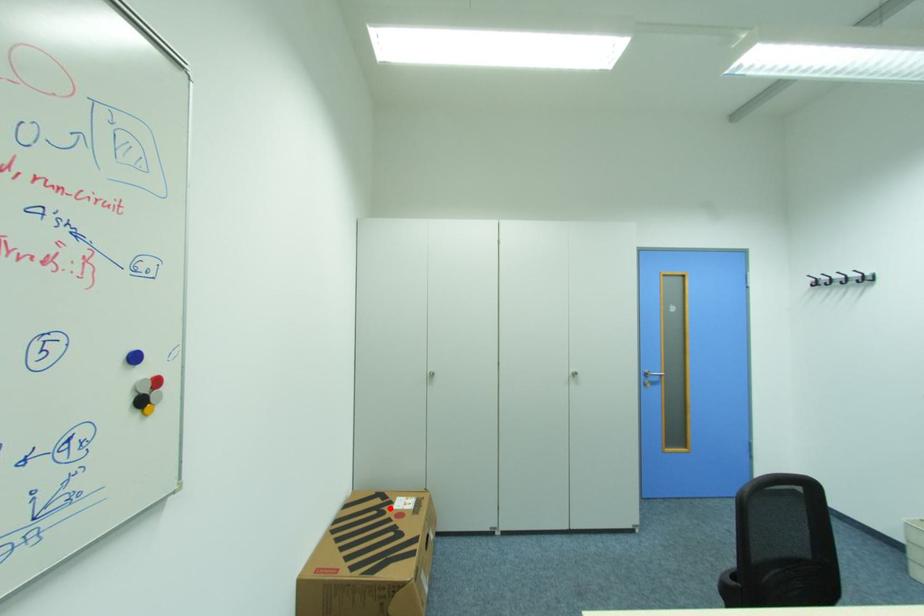
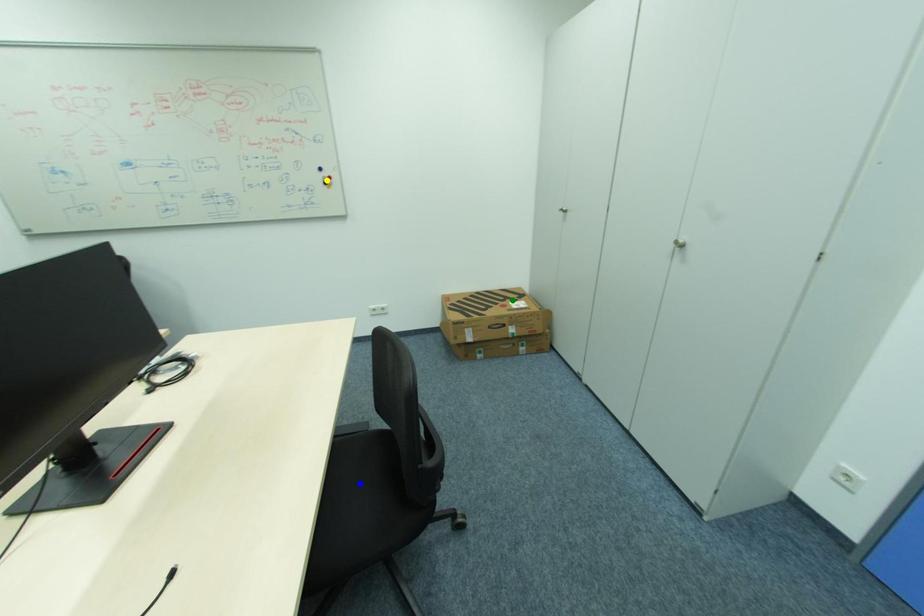
Question: I am providing you with two images of the same scene from different viewpoints. A red point is marked on the first image. You are given multiple points on the second image. Which point in image 2 is actually the same real-world point as the red point in image 1?

Choices:
 (A) green point
 (B) blue point
 (C) yellow point

Answer: (A)